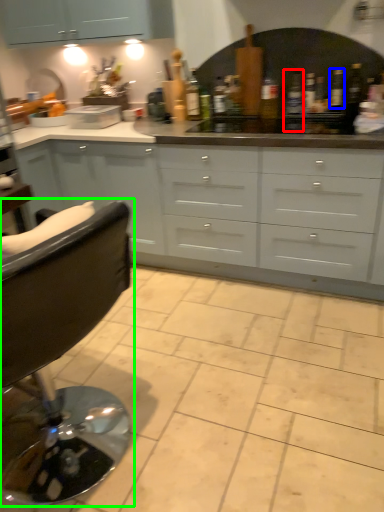
Question: Estimate the real-world distances between objects in this image. Which object is closer to bottle (highlighted by a red box), bottle (highlighted by a blue box) or chair (highlighted by a green box)?

Choices:
 (A) bottle
 (B) chair

Answer: (A)